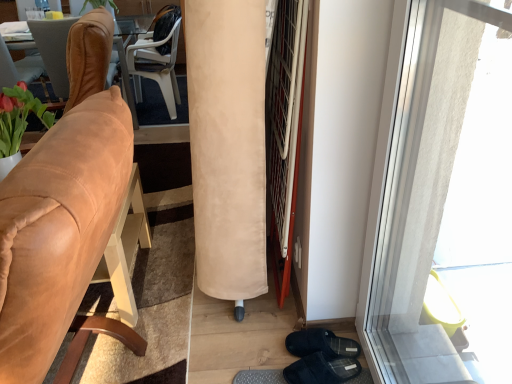
Question: Considering the positions of brown leather chair at left, positioned as the second chair in front-to-back order, and beige suede curtain at center in the image, is brown leather chair at left, positioned as the second chair in front-to-back order, wider or thinner than beige suede curtain at center?

Choices:
 (A) wide
 (B) thin

Answer: (A)

Question: Is brown leather chair at left, positioned as the second chair in front-to-back order, inside the boundaries of beige suede curtain at center, or outside?

Choices:
 (A) outside
 (B) inside

Answer: (A)

Question: Which is nearer to the suede tan chair at left, which is the first chair from front to back?

Choices:
 (A) brown leather chair at left, the second chair positioned from the back
 (B) transparent glass window at right
 (C) beige suede curtain at center
 (D) white plastic chair at upper center, which is the 3th chair from front to back

Answer: (C)

Question: Which of these objects is positioned closest to the brown leather chair at left, the second chair positioned from the back?

Choices:
 (A) white plastic chair at upper center, which is the 3th chair from front to back
 (B) suede tan chair at left, which is the 3th chair in back-to-front order
 (C) beige suede curtain at center
 (D) transparent glass window at right

Answer: (C)